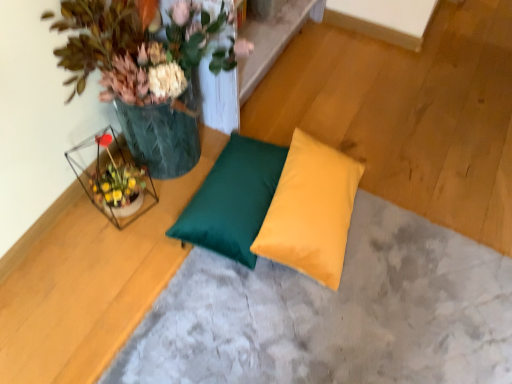
This screenshot has width=512, height=384. Identify the location of vacant area that lies between matte green pillow at center and satin green pillow at center, which is the 1th pillow in left-to-right order. (141, 293).